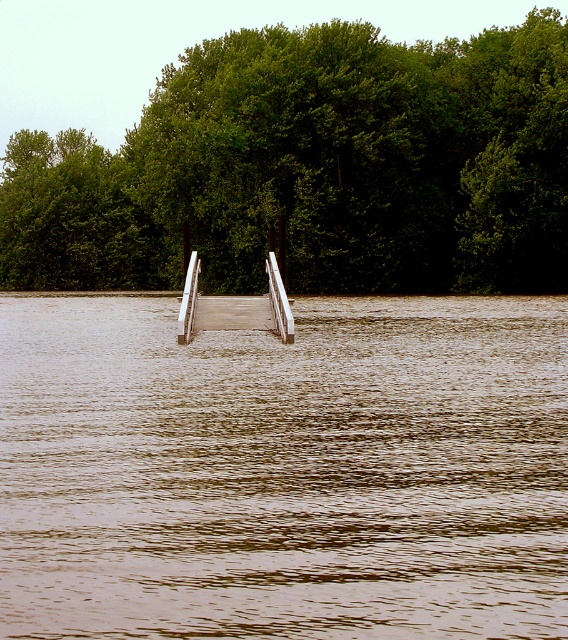
Can you confirm if green leafy trees at center is smaller than wooden dock at center?

No.

Who is more forward, (82,140) or (190,326)?

Positioned in front is point (190,326).

Image resolution: width=568 pixels, height=640 pixels. Find the location of `green leafy trees at center`. green leafy trees at center is located at coordinates (312, 170).

What do you see at coordinates (285, 468) in the screenshot? This screenshot has width=568, height=640. I see `brown muddy water at center` at bounding box center [285, 468].

Is point (170, 310) behind point (193, 262)?

That is True.

This screenshot has height=640, width=568. In order to click on brown muddy water at center in this screenshot , I will do `click(285, 468)`.

Between brown muddy water at center and green leafy trees at center, which one has less height?

brown muddy water at center is shorter.

Which is below, brown muddy water at center or green leafy trees at center?

brown muddy water at center is below.

Who is more distant from viewer, (243, 493) or (374, 253)?

Point (374, 253)

Find the location of a particular element. Image resolution: width=568 pixels, height=640 pixels. brown muddy water at center is located at coordinates coord(285,468).